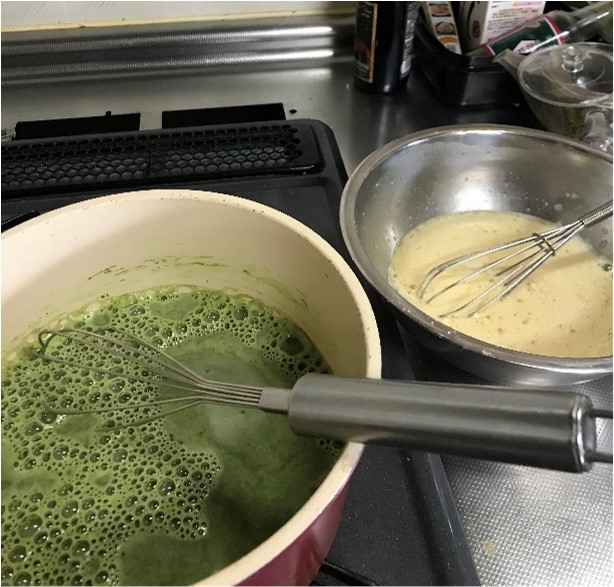
You are a GUI agent. You are given a task and a screenshot of the screen. Output one action in this format:
    pyautogui.click(x=<x>, y=<y>)
    Task: Click on the containers
    This screenshot has width=614, height=587.
    Given the screenshot: What is the action you would take?
    pyautogui.click(x=367, y=26), pyautogui.click(x=449, y=26), pyautogui.click(x=498, y=22), pyautogui.click(x=553, y=32)